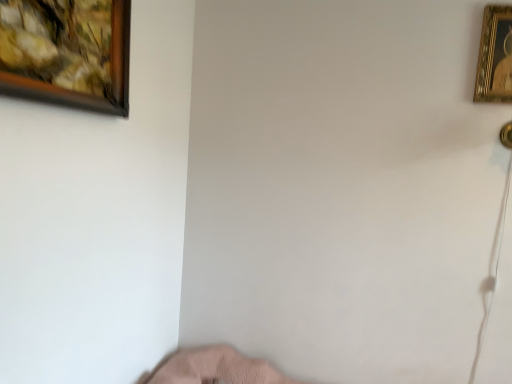
Question: From a real-world perspective, is gold metallic picture frame at upper right, marked as the first picture frame in a right-to-left arrangement, above or below wooden framed painting at upper left, positioned as the 2th picture frame in back-to-front order?

Choices:
 (A) above
 (B) below

Answer: (A)

Question: In terms of height, does gold metallic picture frame at upper right, which is counted as the second picture frame, starting from the left, look taller or shorter compared to wooden framed painting at upper left, which is the 1th picture frame in front-to-back order?

Choices:
 (A) tall
 (B) short

Answer: (A)

Question: Is gold metallic picture frame at upper right, which is counted as the second picture frame, starting from the left, to the left or to the right of wooden framed painting at upper left, positioned as the 2th picture frame in back-to-front order, in the image?

Choices:
 (A) left
 (B) right

Answer: (B)

Question: In terms of height, does wooden framed painting at upper left, which ranks as the second picture frame in right-to-left order, look taller or shorter compared to gold metallic picture frame at upper right, the second picture frame in the front-to-back sequence?

Choices:
 (A) tall
 (B) short

Answer: (B)

Question: Looking at the image, does wooden framed painting at upper left, which is the 1th picture frame in front-to-back order, seem bigger or smaller compared to gold metallic picture frame at upper right, which is counted as the second picture frame, starting from the left?

Choices:
 (A) big
 (B) small

Answer: (A)

Question: Is wooden framed painting at upper left, which is the first picture frame in left-to-right order, inside the boundaries of gold metallic picture frame at upper right, the second picture frame in the front-to-back sequence, or outside?

Choices:
 (A) inside
 (B) outside

Answer: (B)

Question: Is point (39, 11) positioned closer to the camera than point (501, 84)?

Choices:
 (A) farther
 (B) closer

Answer: (B)